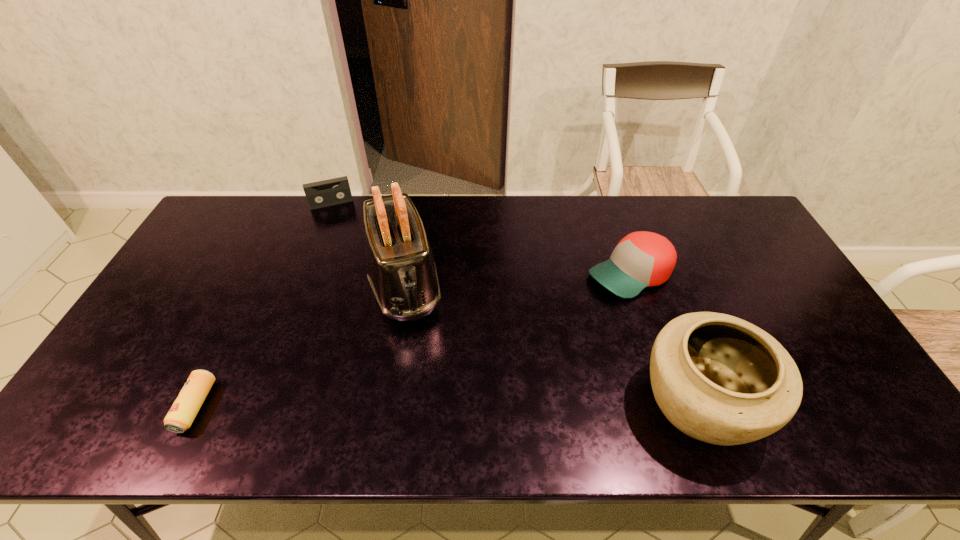
Find the location of a particular element. Image resolution: width=960 pixels, height=540 pixels. vacant region that satisfies the following two spatial constraints: 1. on the front side of the pottery; 2. on the right side of the toaster is located at coordinates (385, 403).

Identify the location of free location that satisfies the following two spatial constraints: 1. on the back side of the third tallest object; 2. on the right side of the toaster. The width and height of the screenshot is (960, 540). (406, 274).